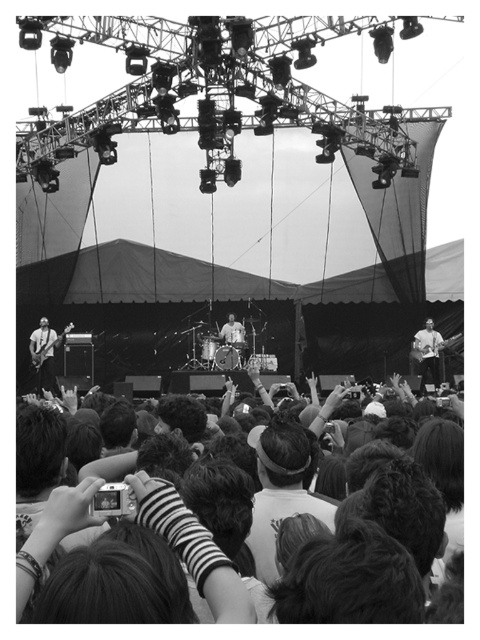
Question: Is matte black guitar at left below smooth white shirt at right?

Choices:
 (A) yes
 (B) no

Answer: (A)

Question: Which object is positioned closest to the smooth white shirt at right?

Choices:
 (A) dark hair at lower center
 (B) matte black guitar at left

Answer: (A)

Question: Among these points, which one is farthest from the camera?

Choices:
 (A) (37, 353)
 (B) (240, 609)
 (C) (421, 376)

Answer: (A)

Question: Observing the image, what is the correct spatial positioning of dark hair at lower center in reference to matte black guitar at left?

Choices:
 (A) right
 (B) left

Answer: (A)

Question: Considering the relative positions of dark hair at lower center and matte black guitar at left in the image provided, where is dark hair at lower center located with respect to matte black guitar at left?

Choices:
 (A) left
 (B) right

Answer: (B)

Question: Which point is farther from the camera taking this photo?

Choices:
 (A) (31, 566)
 (B) (37, 388)
 (C) (420, 356)

Answer: (B)